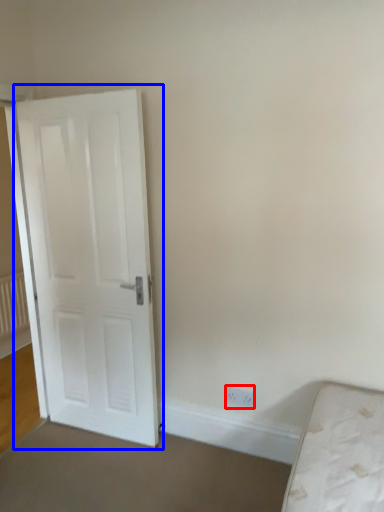
Question: Which point is further to the camera, electric outlet (highlighted by a red box) or door (highlighted by a blue box)?

Choices:
 (A) electric outlet
 (B) door

Answer: (A)